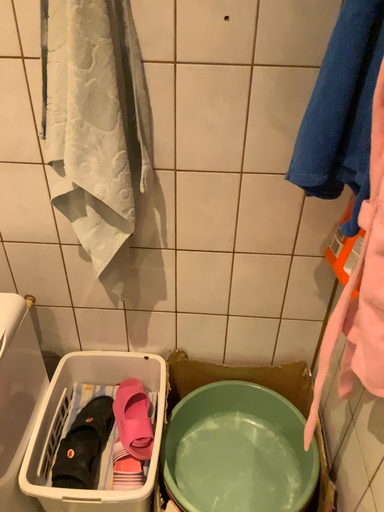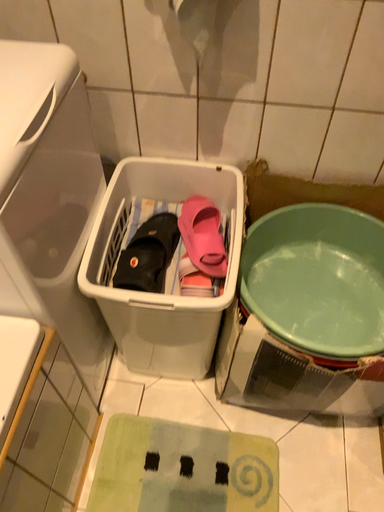
Question: Which way did the camera rotate in the video?

Choices:
 (A) rotated upward
 (B) rotated downward

Answer: (B)